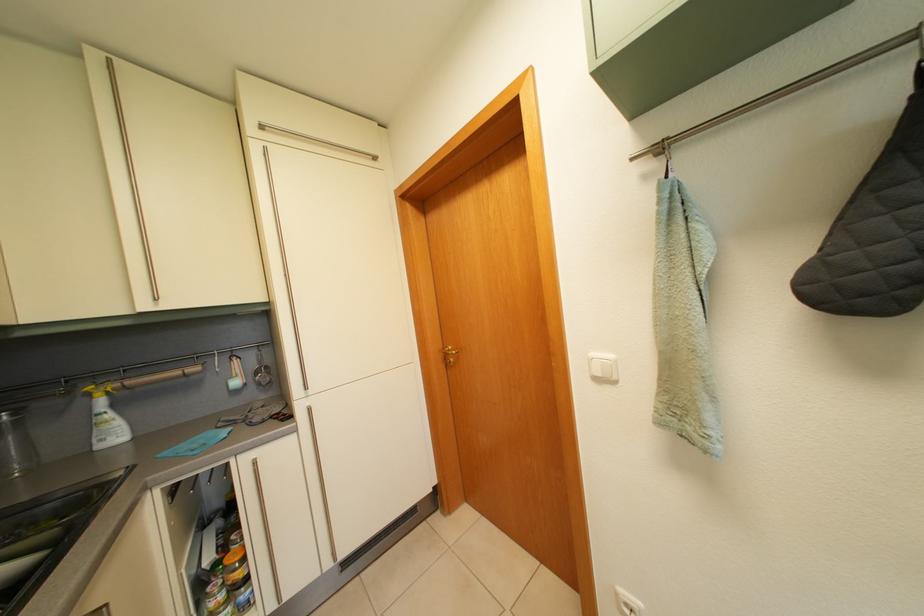
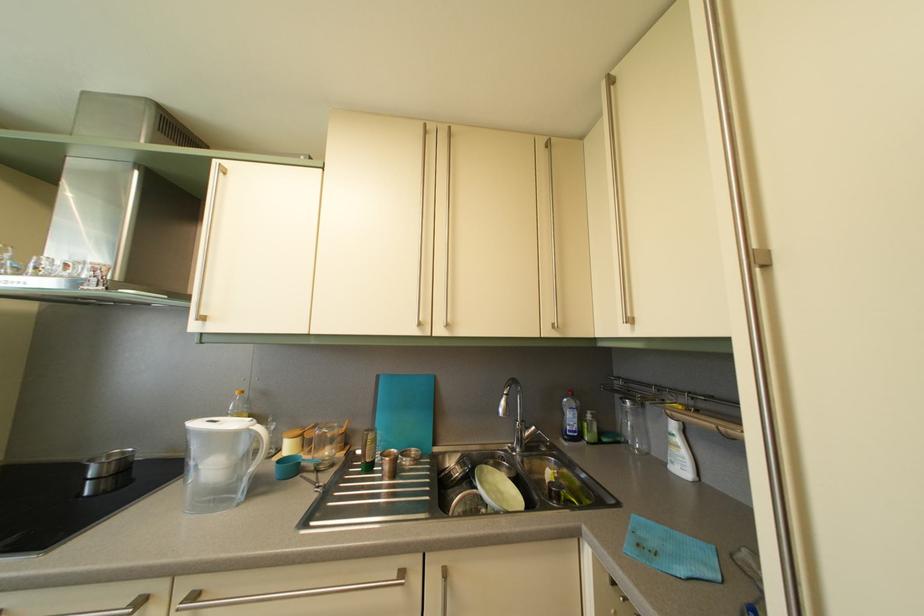
The point at [118,423] is marked in the first image. Where is the corresponding point in the second image?

(687, 448)